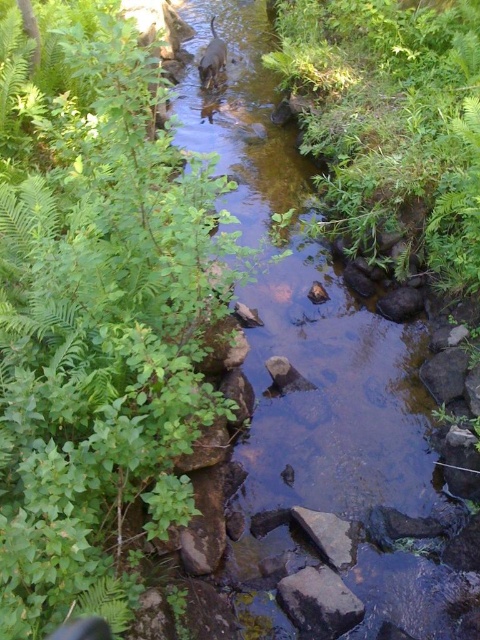
You are a hiker trying to cross the stream. You see a green leafy plant at center and a gray rough rock at center. Which object should you step on to avoid getting wet?

The gray rough rock at center is the better choice to step on because it is positioned to the right of the green leafy plant at center, which is likely above the water, making it stable and less likely to get you wet compared to the plant.

You are standing at the point marked by the coordinates point (351, 456) in this natural scene. Based on the description, what feature of the environment are you currently positioned on?

The point (351, 456) corresponds to the clear water stream at center, so you are positioned on the clear water stream at center.